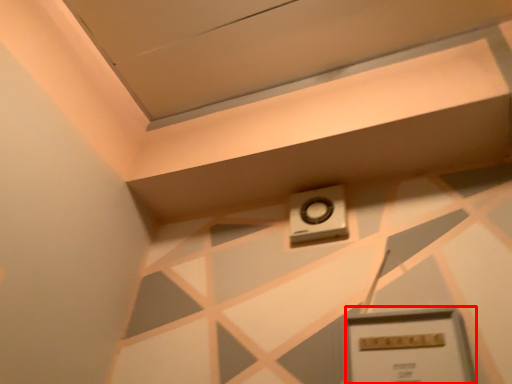
Question: From the image, what is the correct spatial relationship of rectangle (annotated by the red box) in relation to alarm?

Choices:
 (A) left
 (B) right

Answer: (B)